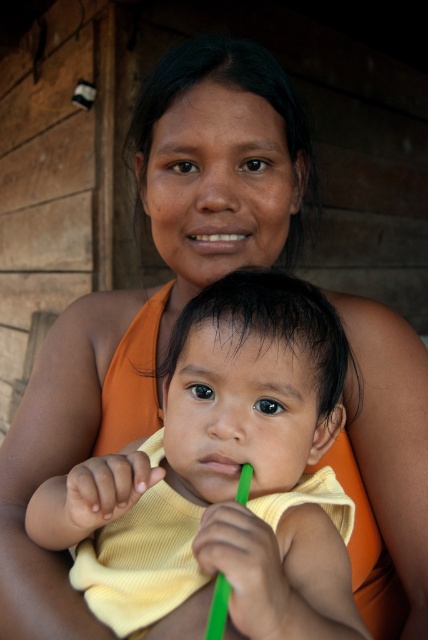
Looking at this image, is the position of yellow fabric baby at center less distant than that of matte skin at center?

Yes, it is in front of matte skin at center.

Between yellow fabric baby at center and matte skin at center, which one appears on the left side from the viewer's perspective?

From the viewer's perspective, yellow fabric baby at center appears more on the left side.

Who is more forward, (205, 296) or (202, 241)?

Positioned in front is point (205, 296).

Identify the location of yellow fabric baby at center. The image size is (428, 640). (238, 456).

Who is taller, matte skin at center or green plastic toothbrush at lower center?

Standing taller between the two is matte skin at center.

In the scene shown: Can you confirm if matte skin at center is positioned below green plastic toothbrush at lower center?

No, matte skin at center is not below green plastic toothbrush at lower center.

The height and width of the screenshot is (640, 428). Find the location of `matte skin at center`. matte skin at center is located at coordinates click(x=216, y=237).

This screenshot has height=640, width=428. Find the location of `matte skin at center`. matte skin at center is located at coordinates (216, 237).

Is yellow fabric baby at center shorter than green plastic toothbrush at lower center?

In fact, yellow fabric baby at center may be taller than green plastic toothbrush at lower center.

Is yellow fabric baby at center positioned at the back of green plastic toothbrush at lower center?

No, yellow fabric baby at center is closer to the viewer.

Does point (264, 392) come in front of point (223, 468)?

Yes, point (264, 392) is in front of point (223, 468).

Find the location of `yellow fabric baby at center`. yellow fabric baby at center is located at coordinates click(238, 456).